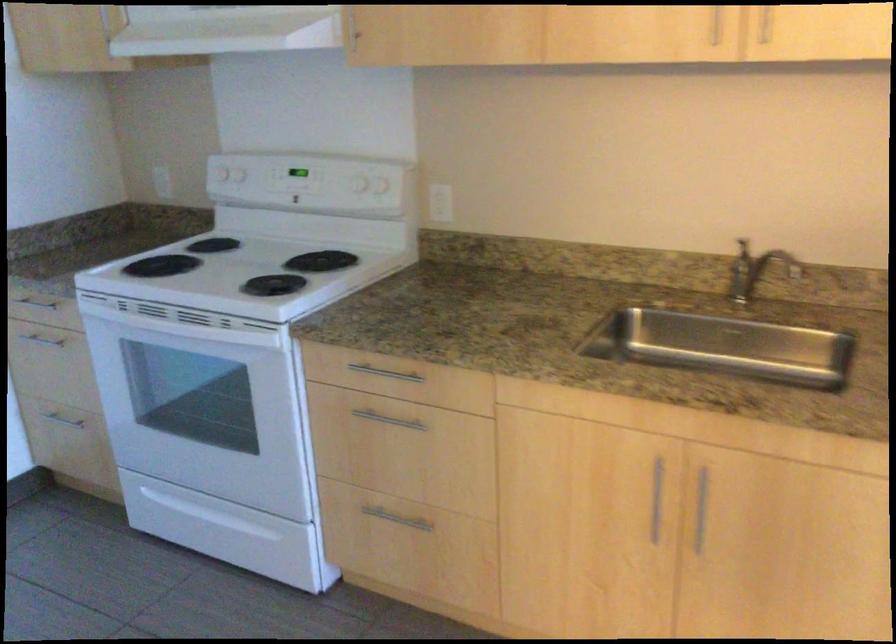
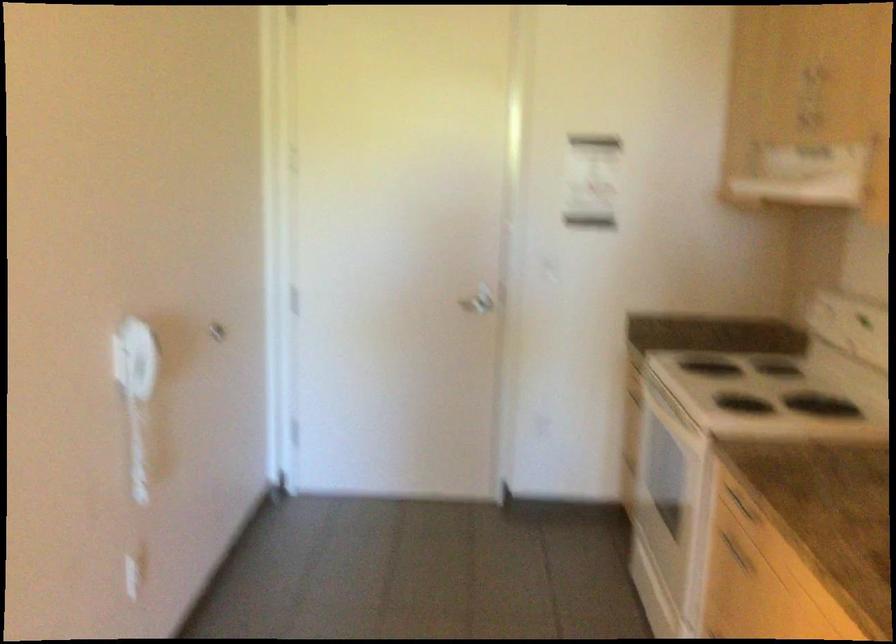
The point at (375, 424) is marked in the first image. Where is the corresponding point in the second image?

(735, 552)